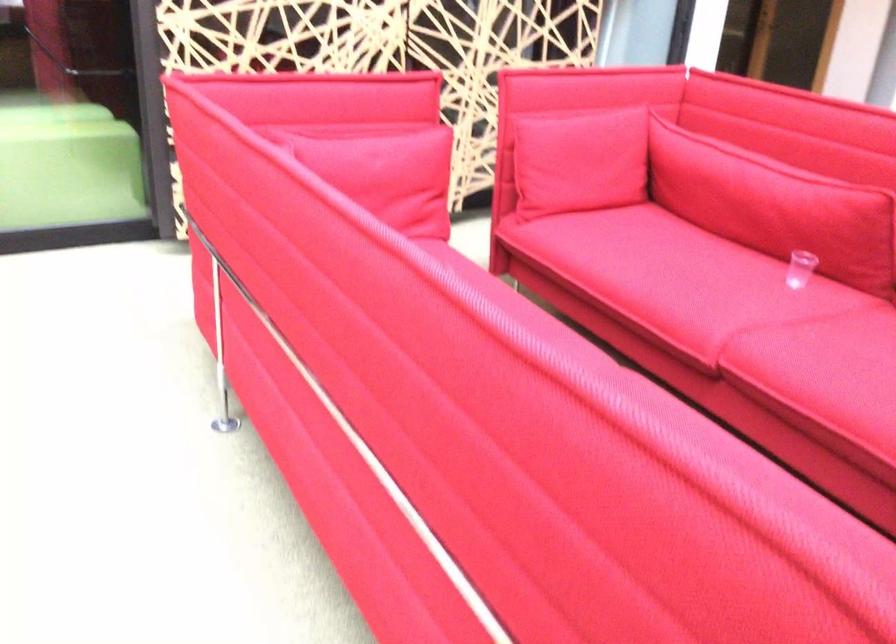
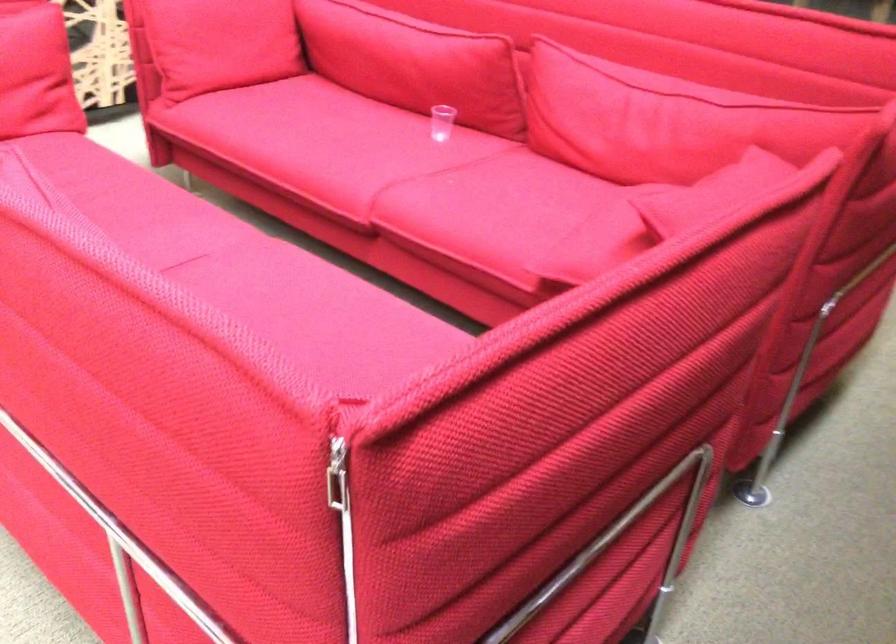
Locate, in the second image, the point that corresponds to point 667,277 in the first image.

(320, 146)